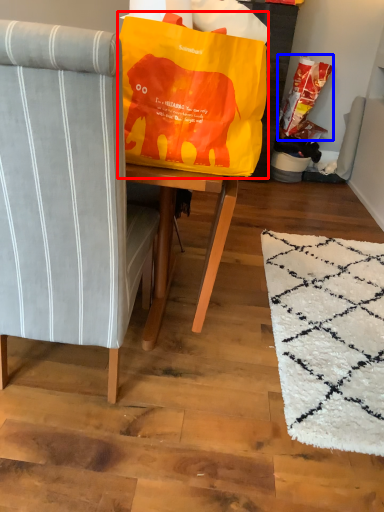
Question: Among these objects, which one is nearest to the camera, bean bag chair (highlighted by a red box) or grocery bag (highlighted by a blue box)?

Choices:
 (A) bean bag chair
 (B) grocery bag

Answer: (A)